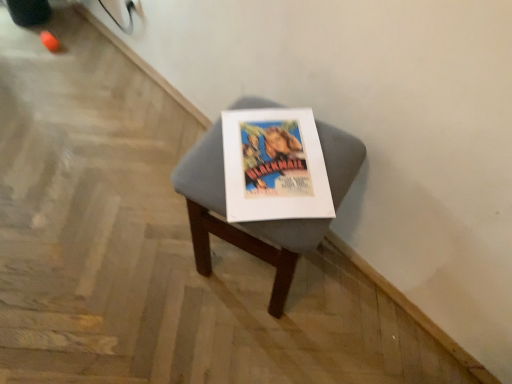
The image size is (512, 384). Identify the location of empty space that is ontop of matte paper poster at center (from a real-world perspective). (274, 155).